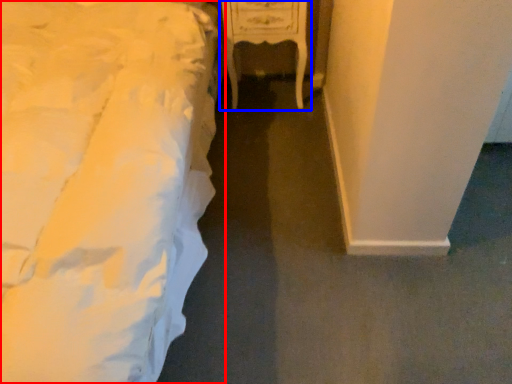
Question: Which point is further to the camera, bed (highlighted by a red box) or furniture (highlighted by a blue box)?

Choices:
 (A) bed
 (B) furniture

Answer: (B)